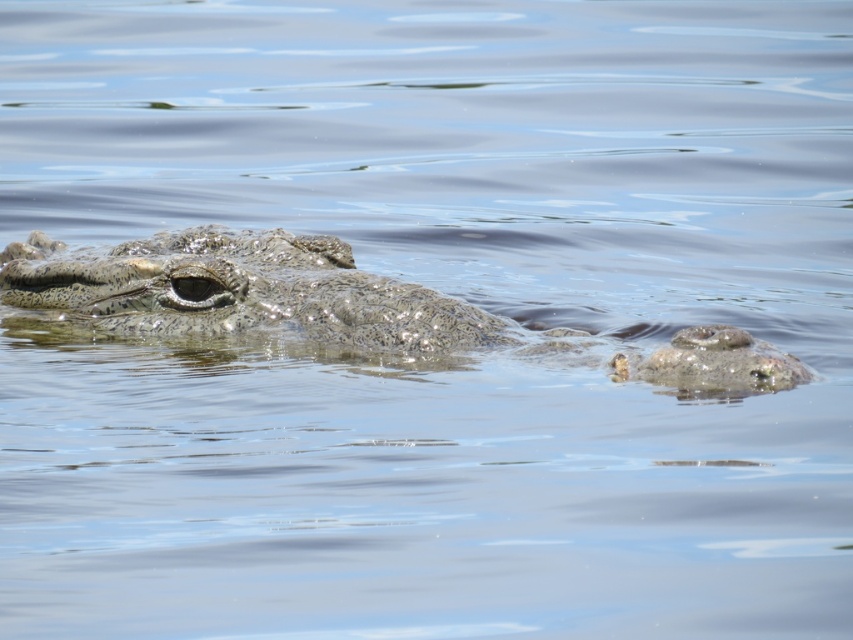
You are a wildlife photographer aiming to capture the crocodile in the image. You need to position your camera at point A, which is at coordinates 0.3, 0.3. To ensure the crocodile is in the center of your shot, should you move your camera to the right or left? Please explain based on the crocodile location at point [251,292].

The crocodile is located at point [251,292]. Since your camera is at 0.3, 0.3, you should move it to the right to align with the crocodile.

You are a wildlife photographer trying to capture a crocodile in its natural habitat. You notice the speckled scaly crocodile at center and the gray textured rock at right. Which object is positioned to the left of the other?

The speckled scaly crocodile at center is to the left of gray textured rock at right.